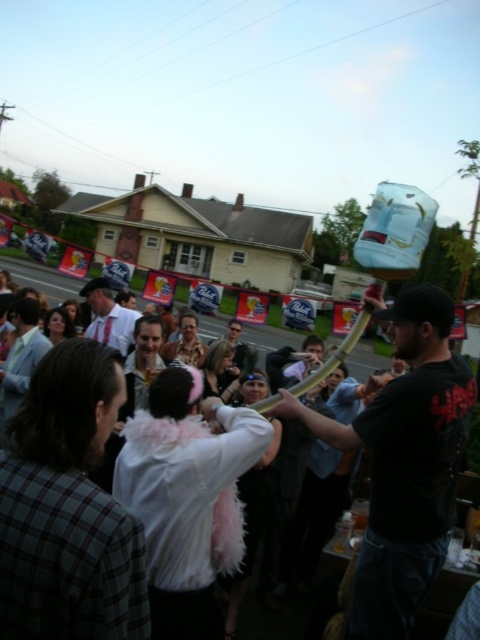
Question: Observing the image, what is the correct spatial positioning of black matte pipe at center in reference to white shirt at center?

Choices:
 (A) right
 (B) left

Answer: (A)

Question: Which object appears farthest from the camera in this image?

Choices:
 (A) white shirt at center
 (B) matte white shirt at center
 (C) black matte pipe at center

Answer: (A)

Question: Which of the following is the closest to the observer?

Choices:
 (A) (445, 468)
 (B) (117, 330)
 (C) (233, 358)

Answer: (A)

Question: Among these points, which one is nearest to the camera?

Choices:
 (A) (235, 346)
 (B) (360, 632)
 (C) (100, 332)

Answer: (B)

Question: Does black matte pipe at center appear under white shirt at center?

Choices:
 (A) no
 (B) yes

Answer: (B)

Question: Does black matte pipe at center have a greater width compared to white shirt at center?

Choices:
 (A) yes
 (B) no

Answer: (A)